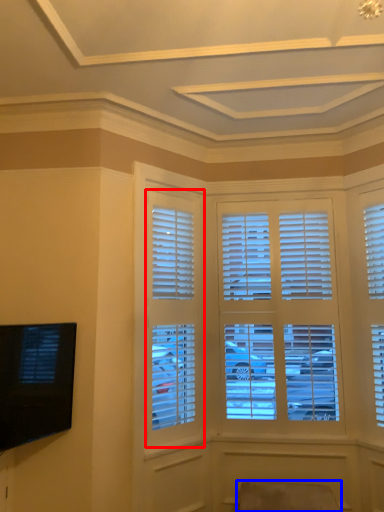
Question: Which of the following is the closest to the observer, window (highlighted by a red box) or swivel chair (highlighted by a blue box)?

Choices:
 (A) window
 (B) swivel chair

Answer: (B)